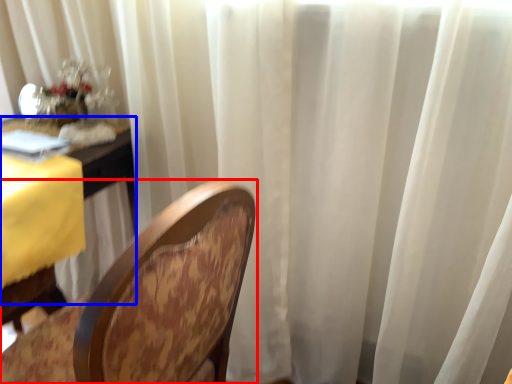
Question: Which of the following is the closest to the observer, chair (highlighted by a red box) or table (highlighted by a blue box)?

Choices:
 (A) chair
 (B) table

Answer: (A)